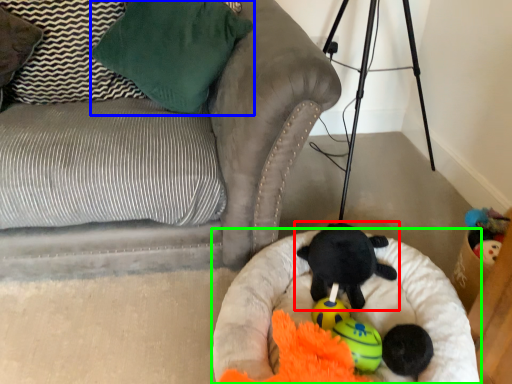
Question: Which object is positioned farthest from toy (highlighted by a red box)? Select from pillow (highlighted by a blue box) and dog bed (highlighted by a green box).

Choices:
 (A) pillow
 (B) dog bed

Answer: (A)